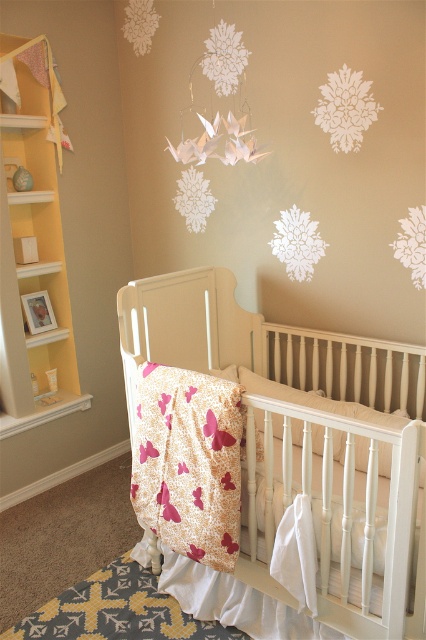
Question: Which point is farther from the camera taking this photo?

Choices:
 (A) (37, 250)
 (B) (319, 426)
 (C) (296, 472)

Answer: (A)

Question: Is white wood crib at center wider than yellow wood bookshelf at left?

Choices:
 (A) yes
 (B) no

Answer: (A)

Question: Which object is the closest to the yellow wood bookshelf at left?

Choices:
 (A) white wood crib at center
 (B) white soft pillow at center

Answer: (A)

Question: Is white wood crib at center smaller than yellow wood bookshelf at left?

Choices:
 (A) yes
 (B) no

Answer: (B)

Question: Which of the following is the closest to the observer?

Choices:
 (A) (25, 164)
 (B) (284, 429)

Answer: (B)

Question: Does yellow wood bookshelf at left come in front of white soft pillow at center?

Choices:
 (A) no
 (B) yes

Answer: (A)